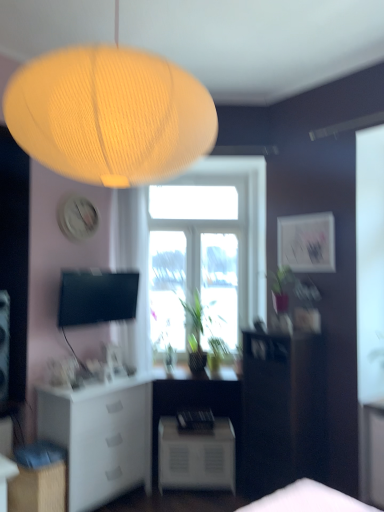
Question: Considering the relative sizes of matte white picture frame at upper right and dark wood cabinet at right in the image provided, is matte white picture frame at upper right smaller than dark wood cabinet at right?

Choices:
 (A) yes
 (B) no

Answer: (A)

Question: Is matte white picture frame at upper right shorter than dark wood cabinet at right?

Choices:
 (A) yes
 (B) no

Answer: (A)

Question: From a real-world perspective, is matte white picture frame at upper right over dark wood cabinet at right?

Choices:
 (A) yes
 (B) no

Answer: (A)

Question: Is dark wood cabinet at right surrounded by matte white picture frame at upper right?

Choices:
 (A) no
 (B) yes

Answer: (A)

Question: Can you confirm if matte white picture frame at upper right is bigger than dark wood cabinet at right?

Choices:
 (A) no
 (B) yes

Answer: (A)

Question: Based on their sizes in the image, would you say white matte nightstand at lower center is bigger or smaller than transparent glass window at center?

Choices:
 (A) small
 (B) big

Answer: (A)

Question: From the image's perspective, relative to transparent glass window at center, is white matte nightstand at lower center above or below?

Choices:
 (A) above
 (B) below

Answer: (B)

Question: Considering the positions of point click(200, 458) and point click(165, 202), is point click(200, 458) closer or farther from the camera than point click(165, 202)?

Choices:
 (A) closer
 (B) farther

Answer: (A)

Question: Is white matte nightstand at lower center wider or thinner than transparent glass window at center?

Choices:
 (A) thin
 (B) wide

Answer: (B)

Question: Is dark wood cabinet at right inside the boundaries of white matte cabinet at lower left, positioned as the 2th cabinetry in back-to-front order, or outside?

Choices:
 (A) inside
 (B) outside

Answer: (B)

Question: Looking at the image, does dark wood cabinet at right seem bigger or smaller compared to white matte cabinet at lower left, marked as the 1th cabinetry in a front-to-back arrangement?

Choices:
 (A) small
 (B) big

Answer: (B)

Question: From a real-world perspective, is dark wood cabinet at right physically located above or below white matte cabinet at lower left, positioned as the 2th cabinetry in back-to-front order?

Choices:
 (A) above
 (B) below

Answer: (A)

Question: From their relative heights in the image, would you say dark wood cabinet at right is taller or shorter than white matte cabinet at lower left, positioned as the 2th cabinetry in back-to-front order?

Choices:
 (A) short
 (B) tall

Answer: (B)

Question: From the image's perspective, is transparent glass window at center located above or below dark wood cabinet at right?

Choices:
 (A) below
 (B) above

Answer: (B)

Question: Would you say transparent glass window at center is to the left or to the right of dark wood cabinet at right in the picture?

Choices:
 (A) right
 (B) left

Answer: (B)